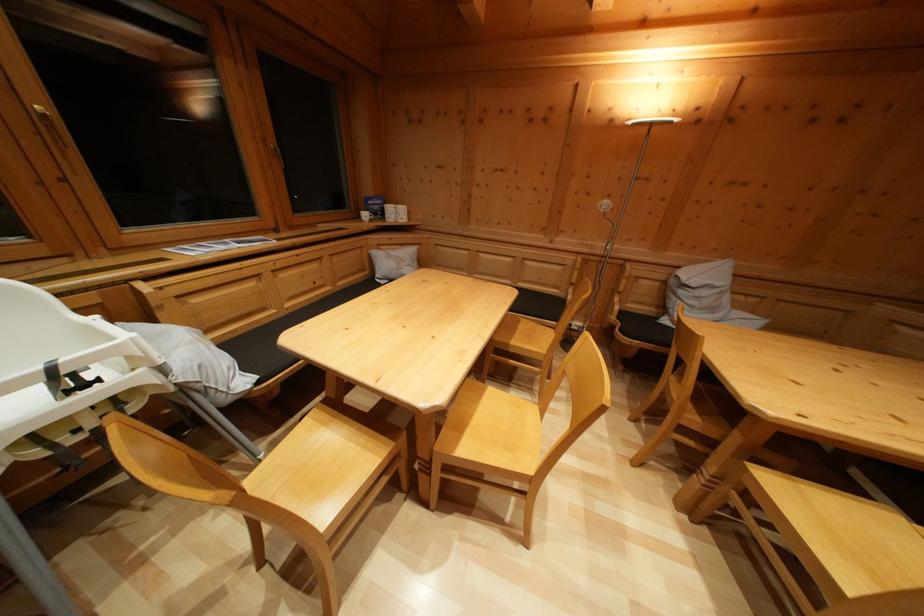
The width and height of the screenshot is (924, 616). I want to click on window handle, so click(55, 131).